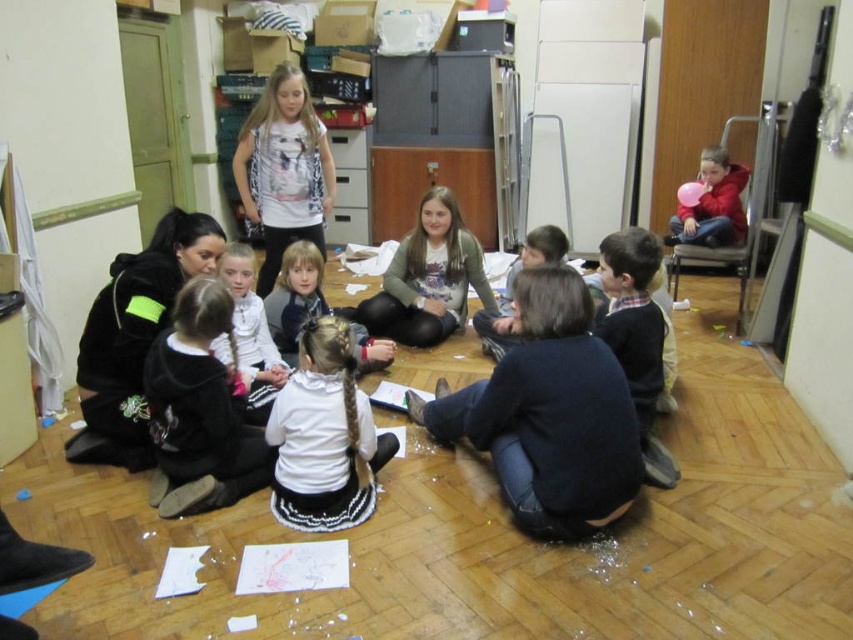
Does dark blue sweater at center come in front of white printed shirt at center?

Yes, it is in front of white printed shirt at center.

Does point (505, 390) lie in front of point (294, 141)?

Yes, it is.

Does point (527, 364) come closer to viewer compared to point (291, 65)?

That is True.

Locate an element on the screen. dark blue sweater at center is located at coordinates (548, 413).

Which of these two, white matte dress at center or red matte balloon at upper right, stands taller?

Standing taller between the two is white matte dress at center.

What do you see at coordinates (294, 296) in the screenshot? The width and height of the screenshot is (853, 640). I see `white matte dress at center` at bounding box center [294, 296].

This screenshot has width=853, height=640. In order to click on white matte dress at center in this screenshot , I will do `click(294, 296)`.

Which is in front, point (549, 269) or point (283, 310)?

Positioned in front is point (549, 269).

The height and width of the screenshot is (640, 853). What do you see at coordinates (548, 413) in the screenshot? I see `dark blue sweater at center` at bounding box center [548, 413].

The width and height of the screenshot is (853, 640). In order to click on dark blue sweater at center in this screenshot , I will do `click(548, 413)`.